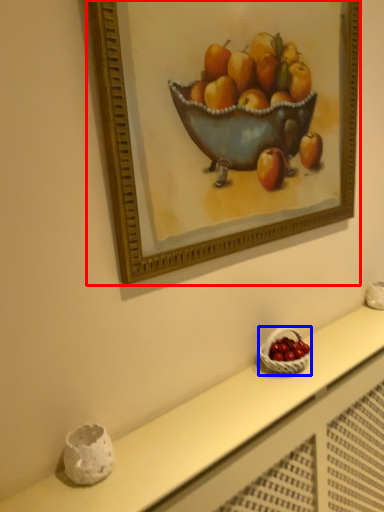
Question: Which point is further to the camera, picture frame (highlighted by a red box) or basket (highlighted by a blue box)?

Choices:
 (A) picture frame
 (B) basket

Answer: (B)